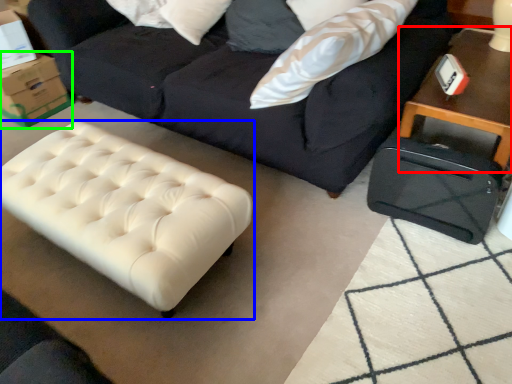
Question: Based on their relative distances, which object is nearer to table (highlighted by a red box)? Choose from table (highlighted by a blue box) and cardboard box (highlighted by a green box).

Choices:
 (A) table
 (B) cardboard box

Answer: (A)